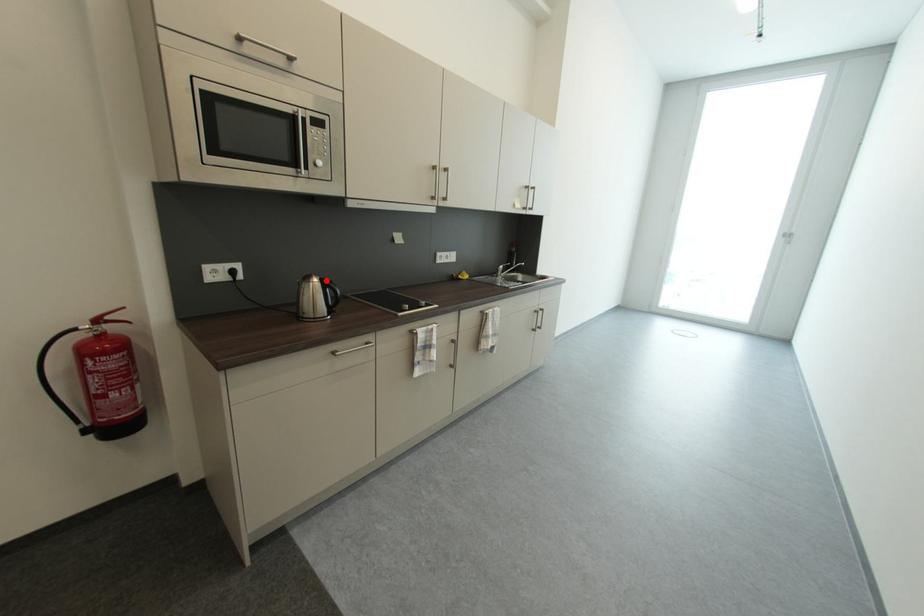
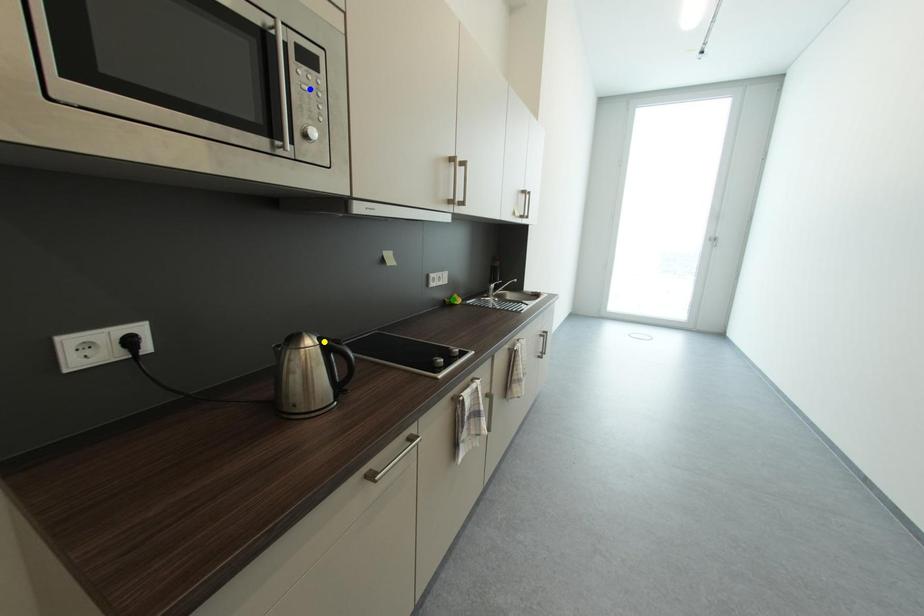
Question: I am providing you with two images of the same scene from different viewpoints. A red point is marked on the first image. You are given multiple points on the second image. In image 2, which mark is for the same physical point as the one in image 1?

Choices:
 (A) yellow point
 (B) green point
 (C) blue point

Answer: (A)